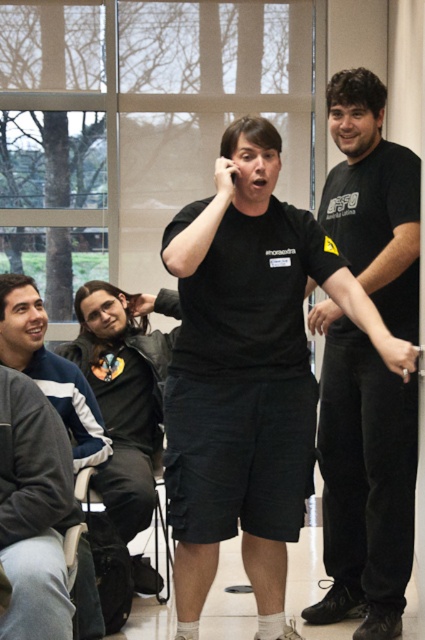
What is the object located at the coordinates point [244,372] in the image?

The point [244,372] indicates black matte shorts at center.

You are an interior designer assessing the layout of this meeting room. You notice the black matte shirt at right and the matte black hand at upper left. Which object occupies more horizontal space in the image?

The black matte shirt at right has a larger width than the matte black hand at upper left, so it occupies more horizontal space in the image.